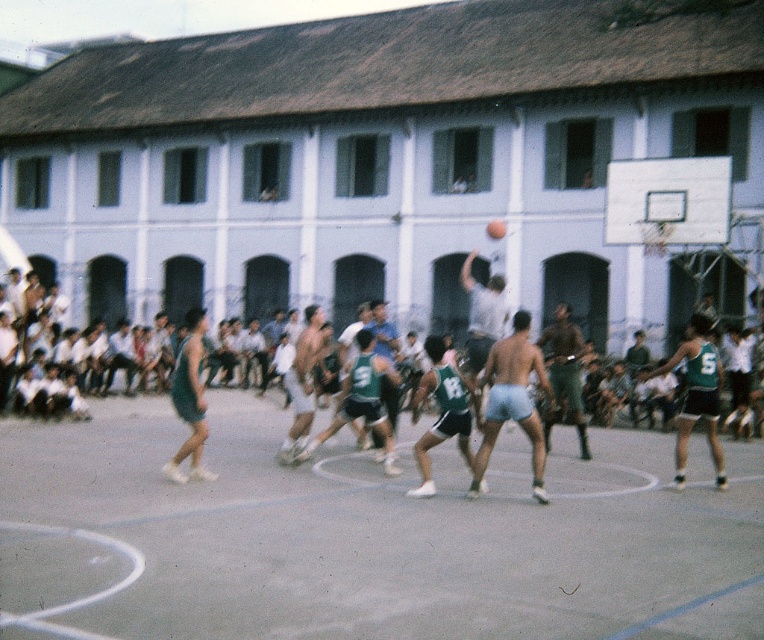
Can you confirm if light blue shorts at center is shorter than green jersey at center?

Incorrect, light blue shorts at center's height does not fall short of green jersey at center's.

Does point (538, 461) come behind point (422, 445)?

No, (538, 461) is closer to viewer.

In order to click on light blue shorts at center in this screenshot , I will do `click(512, 401)`.

Is point (423, 458) positioned before point (306, 339)?

Yes, it is.

Does green jersey at center appear on the right side of matte gray shorts at center?

Indeed, green jersey at center is positioned on the right side of matte gray shorts at center.

This screenshot has height=640, width=764. Identify the location of green jersey at center. pos(442,412).

Identify the location of green jersey at center. click(x=442, y=412).

Can you confirm if green jersey shorts at center is positioned above dark green shorts at center?

Indeed, green jersey shorts at center is positioned over dark green shorts at center.

Is green jersey shorts at center closer to the viewer compared to dark green shorts at center?

No, green jersey shorts at center is behind dark green shorts at center.

Is point (201, 404) positioned in front of point (193, 435)?

Yes, it is.

Find the location of a particular element. green jersey shorts at center is located at coordinates [66, 344].